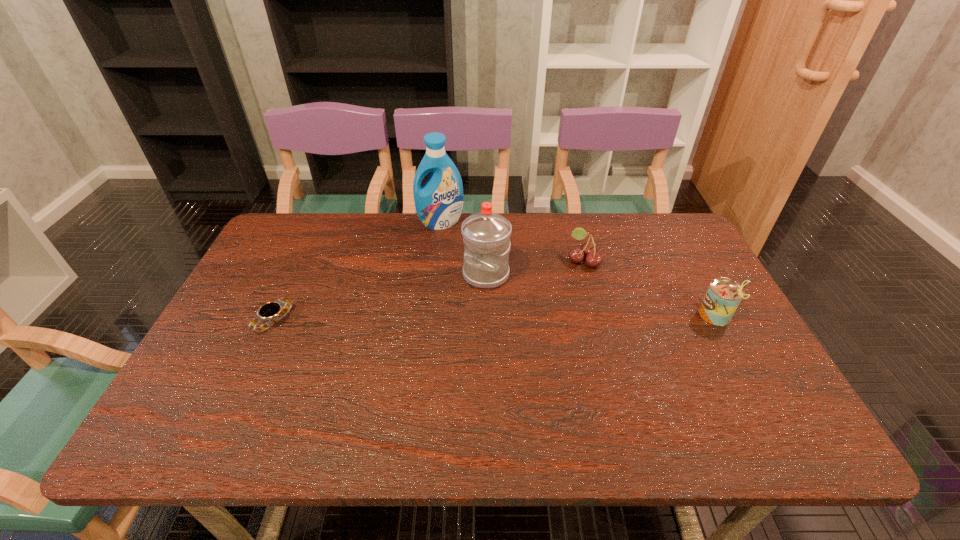
This screenshot has height=540, width=960. In the image, there is a desktop. Identify the location of vacant space at the far right corner. (654, 225).

Find the location of `vacant region at the near right corner of the desktop`. vacant region at the near right corner of the desktop is located at coordinates (733, 395).

Where is `empty space between the fourth shortest object and the can`? This screenshot has width=960, height=540. empty space between the fourth shortest object and the can is located at coordinates (602, 295).

Where is `vacant area that lies between the can and the second object from left to right`? The width and height of the screenshot is (960, 540). vacant area that lies between the can and the second object from left to right is located at coordinates (579, 269).

At what (x,y) coordinates should I click in order to perform the action: click on free space that is in between the fourth shortest object and the second object from right to left. Please return your answer as a coordinate pair (x, y). This screenshot has height=540, width=960. Looking at the image, I should click on (535, 267).

This screenshot has height=540, width=960. In order to click on empty space that is in between the fourth object from left to right and the third shortest object in this screenshot , I will do `click(650, 288)`.

Locate an element on the screen. Image resolution: width=960 pixels, height=540 pixels. empty space between the cherry and the rightmost object is located at coordinates (650, 288).

Where is `vacant area that lies between the leftmost object and the can`? vacant area that lies between the leftmost object and the can is located at coordinates (495, 318).

Locate an element on the screen. The height and width of the screenshot is (540, 960). empty location between the leftmost object and the rightmost object is located at coordinates (495, 318).

You are a GUI agent. You are given a task and a screenshot of the screen. Output one action in this format:
    pyautogui.click(x=<x>, y=<y>)
    Task: Click on the vacant area that lies between the second tallest object and the can
    
    Given the screenshot: What is the action you would take?
    pyautogui.click(x=602, y=295)